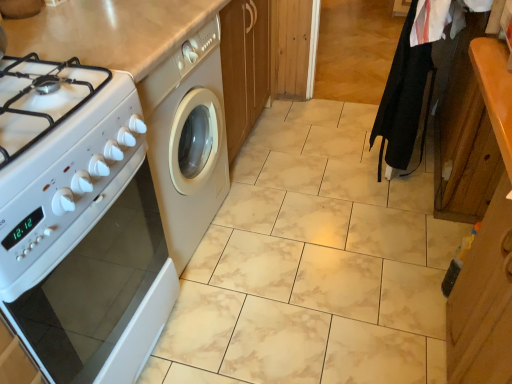
Question: Considering the positions of point (480, 269) and point (379, 112), is point (480, 269) closer or farther from the camera than point (379, 112)?

Choices:
 (A) closer
 (B) farther

Answer: (A)

Question: In terms of size, does wooden cabinet at right appear bigger or smaller than black fabric robe at right?

Choices:
 (A) small
 (B) big

Answer: (B)

Question: Which is nearer to the white glossy oven at left?

Choices:
 (A) wooden cabinet at right
 (B) black fabric robe at right

Answer: (A)

Question: Based on their relative distances, which object is nearer to the white glossy oven at left?

Choices:
 (A) black fabric robe at right
 (B) wooden cabinet at right

Answer: (B)